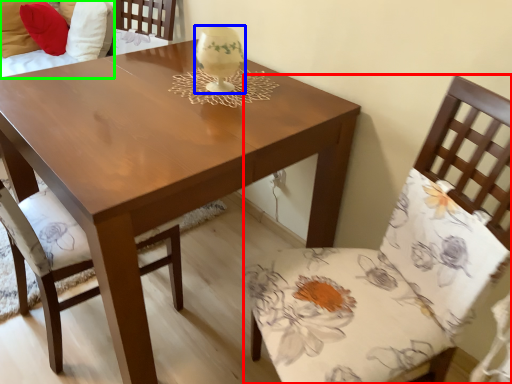
Question: Which object is the farthest from chair (highlighted by a red box)? Choose among these: candle holder (highlighted by a blue box) or couch (highlighted by a green box).

Choices:
 (A) candle holder
 (B) couch

Answer: (B)